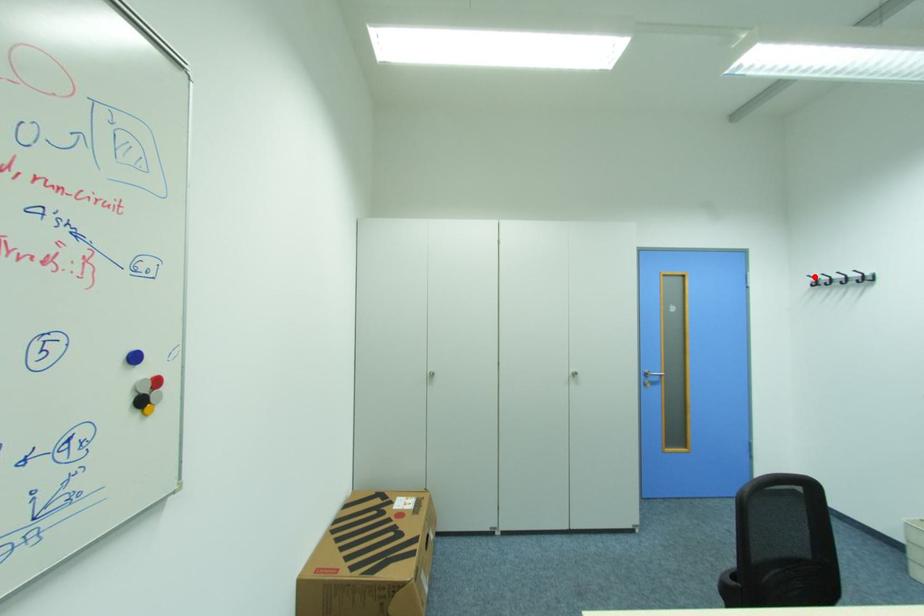
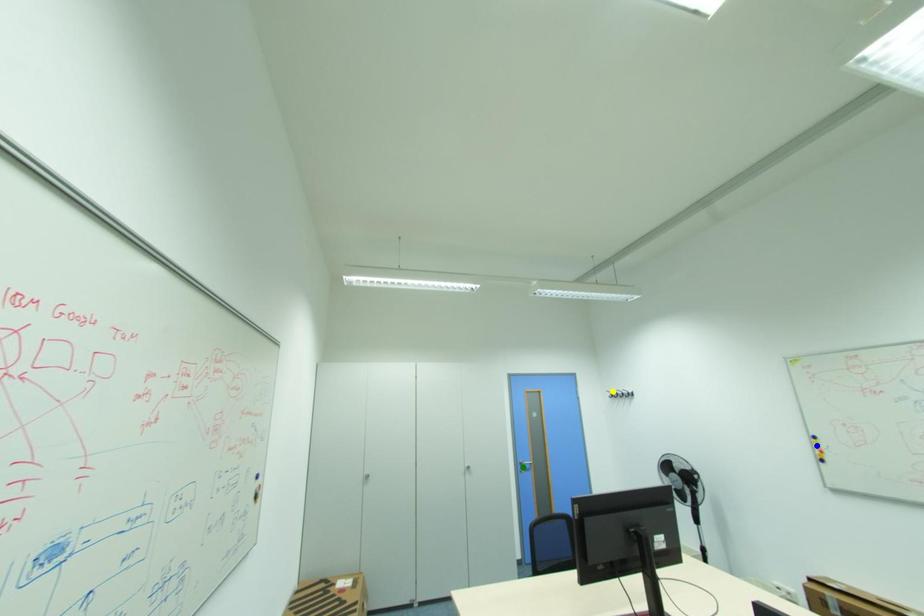
Question: I am providing you with two images of the same scene from different viewpoints. A red point is marked on the first image. You are given multiple points on the second image. Can you choose the point in image 2 that corresponds to the point in image 1?

Choices:
 (A) green point
 (B) yellow point
 (C) blue point

Answer: (B)